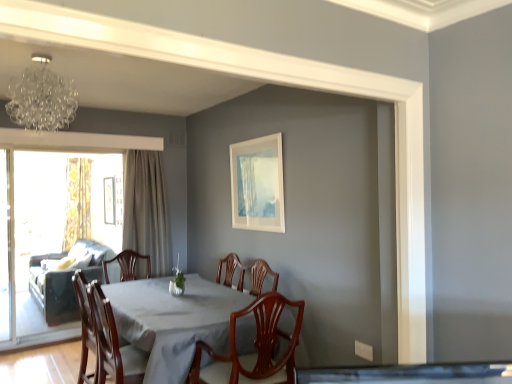
Question: From a real-world perspective, is clear glass screen door at left, which ranks as the first screen door in left-to-right order, below crystal glass chandelier at upper left?

Choices:
 (A) no
 (B) yes

Answer: (B)

Question: Is crystal glass chandelier at upper left at the back of clear glass screen door at left, which ranks as the first screen door in left-to-right order?

Choices:
 (A) yes
 (B) no

Answer: (B)

Question: Is clear glass screen door at left, the 2th screen door viewed from the right, at the left side of crystal glass chandelier at upper left?

Choices:
 (A) yes
 (B) no

Answer: (A)

Question: Considering the relative positions of clear glass screen door at left, which ranks as the first screen door in left-to-right order, and crystal glass chandelier at upper left in the image provided, is clear glass screen door at left, which ranks as the first screen door in left-to-right order, to the right of crystal glass chandelier at upper left from the viewer's perspective?

Choices:
 (A) yes
 (B) no

Answer: (B)

Question: Could you tell me if clear glass screen door at left, the 2th screen door viewed from the right, is facing crystal glass chandelier at upper left?

Choices:
 (A) yes
 (B) no

Answer: (B)

Question: Is mahogany wood chair at center, placed as the first chair when sorted from front to back, to the left or to the right of clear glass screen door at left, which ranks as the first screen door in left-to-right order, in the image?

Choices:
 (A) right
 (B) left

Answer: (A)

Question: From a real-world perspective, is mahogany wood chair at center, placed as the first chair when sorted from front to back, positioned above or below clear glass screen door at left, the 2th screen door viewed from the right?

Choices:
 (A) above
 (B) below

Answer: (B)

Question: Considering the positions of point (214, 359) and point (1, 230), is point (214, 359) closer or farther from the camera than point (1, 230)?

Choices:
 (A) closer
 (B) farther

Answer: (A)

Question: Considering the positions of mahogany wood chair at center, positioned as the second chair in back-to-front order, and clear glass screen door at left, the 2th screen door viewed from the right, in the image, is mahogany wood chair at center, positioned as the second chair in back-to-front order, wider or thinner than clear glass screen door at left, the 2th screen door viewed from the right,?

Choices:
 (A) thin
 (B) wide

Answer: (B)

Question: Considering the positions of gold textured curtain at left, which is counted as the second curtain, starting from the front, and wooden chair at center, which is counted as the second chair, starting from the front, in the image, is gold textured curtain at left, which is counted as the second curtain, starting from the front, wider or thinner than wooden chair at center, which is counted as the second chair, starting from the front,?

Choices:
 (A) thin
 (B) wide

Answer: (A)

Question: Considering their positions, is gold textured curtain at left, the 1th curtain in the back-to-front sequence, located in front of or behind wooden chair at center, which ranks as the first chair in left-to-right order?

Choices:
 (A) front
 (B) behind

Answer: (B)

Question: From their relative heights in the image, would you say gold textured curtain at left, which is counted as the second curtain, starting from the front, is taller or shorter than wooden chair at center, which ranks as the 1th chair in back-to-front order?

Choices:
 (A) tall
 (B) short

Answer: (A)

Question: From the image's perspective, is gold textured curtain at left, arranged as the 1th curtain when viewed from the left, positioned above or below wooden chair at center, which ranks as the first chair in left-to-right order?

Choices:
 (A) below
 (B) above

Answer: (B)

Question: Do you think wooden chair at center, positioned as the 2th chair in right-to-left order, is within transparent glass screen door at left, marked as the 2th screen door in a left-to-right arrangement, or outside of it?

Choices:
 (A) outside
 (B) inside

Answer: (A)

Question: Is wooden chair at center, positioned as the 2th chair in right-to-left order, in front of or behind transparent glass screen door at left, marked as the 1th screen door in a right-to-left arrangement, in the image?

Choices:
 (A) behind
 (B) front

Answer: (B)